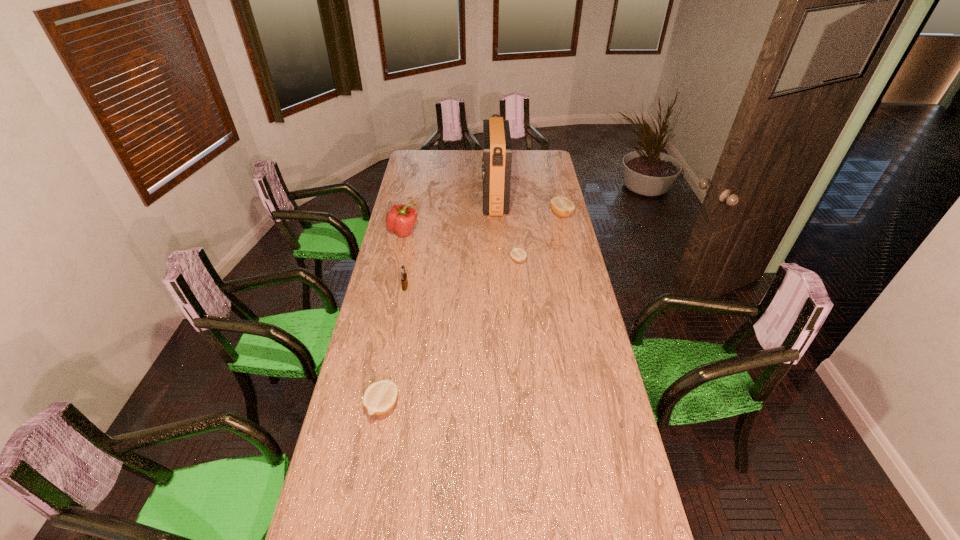
Locate an element on the screen. The image size is (960, 540). padlock that is at the left edge is located at coordinates (404, 281).

Locate an element on the screen. The image size is (960, 540). object present at the right edge is located at coordinates (562, 207).

The height and width of the screenshot is (540, 960). I want to click on free space at the far edge, so click(437, 166).

Locate an element on the screen. This screenshot has height=540, width=960. free space at the near edge of the desktop is located at coordinates (547, 487).

Where is `free space at the left edge of the desktop`? free space at the left edge of the desktop is located at coordinates (420, 179).

Image resolution: width=960 pixels, height=540 pixels. Find the location of `vacant space at the right edge of the desktop`. vacant space at the right edge of the desktop is located at coordinates (580, 303).

The image size is (960, 540). What are the coordinates of `free location at the far right corner` in the screenshot? It's located at (540, 151).

Identify the location of free space between the second tallest object and the radio receiver. (449, 215).

This screenshot has width=960, height=540. In order to click on vacant area that lies between the tallest object and the farthest lemon in this screenshot , I will do `click(528, 207)`.

Find the location of a particular element. Image resolution: width=960 pixels, height=540 pixels. free space between the nearest object and the rightmost object is located at coordinates (471, 310).